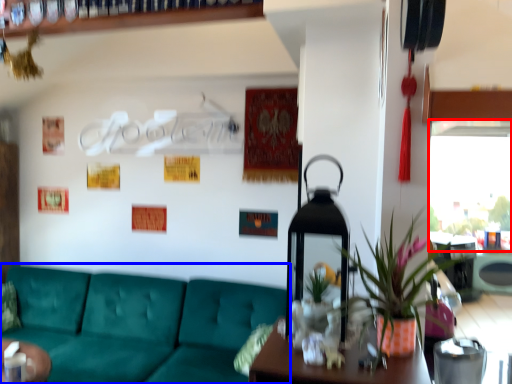
Question: Which object is closer to the camera taking this photo, window screen (highlighted by a red box) or studio couch (highlighted by a blue box)?

Choices:
 (A) window screen
 (B) studio couch

Answer: (B)